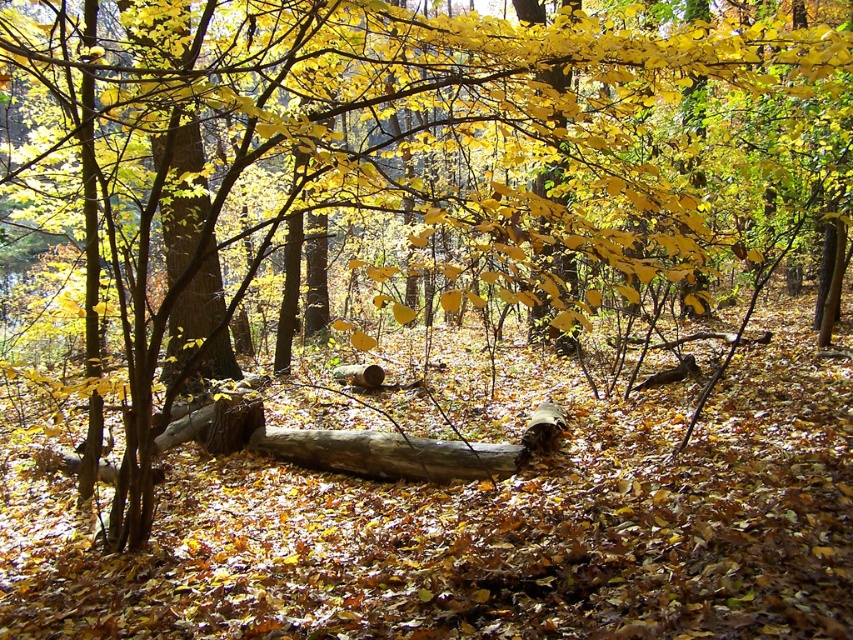
Question: Can you confirm if brown rough tree trunk at center is positioned below smooth brown log at center?

Choices:
 (A) yes
 (B) no

Answer: (B)

Question: Is brown rough tree trunk at center above smooth brown log at center?

Choices:
 (A) yes
 (B) no

Answer: (A)

Question: Can you confirm if brown rough tree trunk at center is smaller than smooth brown log at center?

Choices:
 (A) yes
 (B) no

Answer: (A)